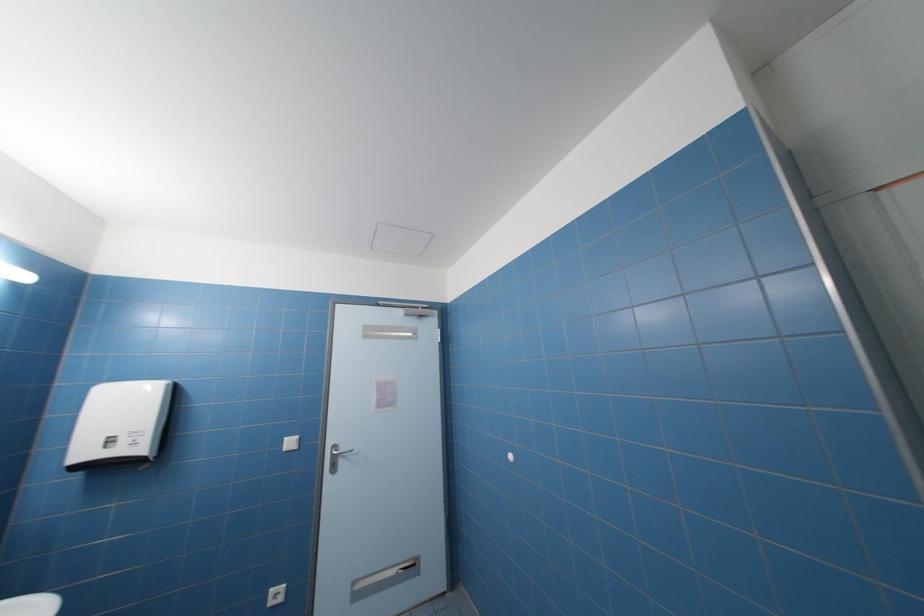
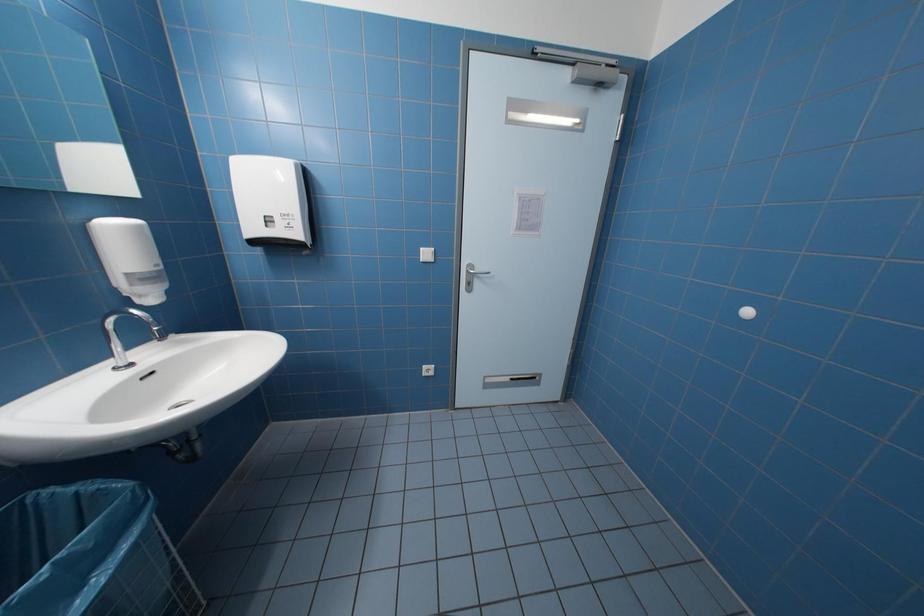
Based on the continuous images, in which direction is the camera rotating?

The camera's rotation is toward left-down.